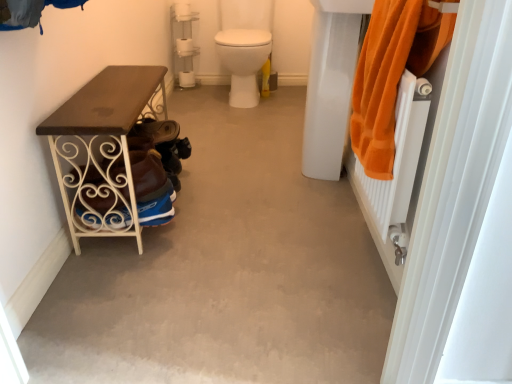
This screenshot has width=512, height=384. Find the location of `smooth concrete floor at center`. smooth concrete floor at center is located at coordinates (225, 271).

Measure the distance between orange terry cloth towel at right and camera.

orange terry cloth towel at right is 91.20 centimeters from camera.

The width and height of the screenshot is (512, 384). What do you see at coordinates (245, 63) in the screenshot?
I see `white glossy toilet at center` at bounding box center [245, 63].

Measure the distance between white glossy toilet at center and camera.

white glossy toilet at center is 8.33 feet from camera.

I want to click on brown wood table at left, so click(x=103, y=151).

Can you confirm if brown wood table at left is positioned to the right of brown suede shoe at lower left?

No, brown wood table at left is not to the right of brown suede shoe at lower left.

Is brown wood table at left surrounding brown suede shoe at lower left?

Yes, brown suede shoe at lower left is inside brown wood table at left.

Can you tell me how much brown wood table at left and brown suede shoe at lower left differ in facing direction?

0.00465 degrees.

Is brown wood table at left turned away from brown suede shoe at lower left?

Absolutely, brown wood table at left is directed away from brown suede shoe at lower left.

How much distance is there between brown suede shoe at lower left and brown wood table at left?

10.58 inches.

From the image's perspective, is brown suede shoe at lower left beneath brown wood table at left?

Actually, brown suede shoe at lower left appears above brown wood table at left in the image.

Is point (152, 120) positioned before point (129, 175)?

No, it is behind (129, 175).

Where is `furniture that is in front of the brown suede shoe at lower left`? furniture that is in front of the brown suede shoe at lower left is located at coordinates [103, 151].

Does point (245, 197) lie in front of point (100, 78)?

No, (245, 197) is further to viewer.

Considering the sizes of objects smooth concrete floor at center and brown wood table at left in the image provided, who is bigger, smooth concrete floor at center or brown wood table at left?

Bigger between the two is brown wood table at left.

Is smooth concrete floor at center spatially inside brown wood table at left, or outside of it?

smooth concrete floor at center lies outside brown wood table at left.

From their relative heights in the image, would you say smooth concrete floor at center is taller or shorter than brown wood table at left?

Considering their sizes, smooth concrete floor at center has less height than brown wood table at left.

Visually, is orange terry cloth towel at right positioned to the left or to the right of brown wood table at left?

orange terry cloth towel at right is to the right of brown wood table at left.

Does point (379, 70) lie in front of point (63, 154)?

Yes, it is.

Which of these two, orange terry cloth towel at right or brown wood table at left, is bigger?

brown wood table at left is bigger.

Is brown wood table at left inside orange terry cloth towel at right?

No, brown wood table at left is located outside of orange terry cloth towel at right.

Is brown wood table at left positioned beyond the bounds of orange terry cloth towel at right?

Yes.

Is brown wood table at left directly adjacent to orange terry cloth towel at right?

They are not placed beside each other.

Locate an element on the screen. furniture on the left of orange terry cloth towel at right is located at coordinates (103, 151).

Considering the sizes of objects white glossy toilet at center and smooth concrete floor at center in the image provided, who is shorter, white glossy toilet at center or smooth concrete floor at center?

With less height is smooth concrete floor at center.

Looking at this image, is white glossy toilet at center facing towards smooth concrete floor at center?

Yes, white glossy toilet at center is turned towards smooth concrete floor at center.

From a real-world perspective, is white glossy toilet at center positioned above or below smooth concrete floor at center?

white glossy toilet at center is situated higher than smooth concrete floor at center in the real world.

Is white glossy toilet at center not near smooth concrete floor at center?

Yes, white glossy toilet at center is far from smooth concrete floor at center.

Which of these two, brown suede shoe at lower left or white glossy sink at upper right, is wider?

white glossy sink at upper right.

Is brown suede shoe at lower left aimed at white glossy sink at upper right?

Yes, brown suede shoe at lower left is aimed at white glossy sink at upper right.

Is there a large distance between brown suede shoe at lower left and white glossy sink at upper right?

No, there isn't a large distance between brown suede shoe at lower left and white glossy sink at upper right.

Locate an element on the screen. shoe lying above the brown wood table at left (from the image's perspective) is located at coordinates (156, 130).

Where is `shoe on the right of brown wood table at left`? This screenshot has height=384, width=512. shoe on the right of brown wood table at left is located at coordinates (156, 130).

When comparing their distances from brown wood table at left, does orange terry cloth towel at right or white glossy toilet at center seem further?

white glossy toilet at center lies further to brown wood table at left than the other object.

Based on the photo, which object lies further to the anchor point brown wood table at left, orange terry cloth towel at right or smooth concrete floor at center?

orange terry cloth towel at right.

In the scene shown: From the image, which object appears to be nearer to white glossy sink at upper right, white glossy toilet at center or brown wood table at left?

brown wood table at left is closer to white glossy sink at upper right.

From the picture: Estimate the real-world distances between objects in this image. Which object is further from smooth concrete floor at center, white glossy sink at upper right or white glossy toilet at center?

white glossy toilet at center is positioned further to the anchor smooth concrete floor at center.

Considering their positions, is white glossy sink at upper right positioned closer to smooth concrete floor at center than brown wood table at left?

brown wood table at left is positioned closer to the anchor smooth concrete floor at center.

Based on their spatial positions, is white glossy sink at upper right or orange terry cloth towel at right closer to brown suede shoe at lower left?

white glossy sink at upper right.

When comparing their distances from white glossy toilet at center, does orange terry cloth towel at right or brown suede shoe at lower left seem further?

Based on the image, orange terry cloth towel at right appears to be further to white glossy toilet at center.

Looking at the image, which one is located closer to orange terry cloth towel at right, smooth concrete floor at center or brown suede shoe at lower left?

smooth concrete floor at center lies closer to orange terry cloth towel at right than the other object.

Locate an element on the screen. concrete between orange terry cloth towel at right and white glossy sink at upper right from front to back is located at coordinates (225, 271).

Find the location of a particular element. shoe between brown wood table at left and orange terry cloth towel at right from left to right is located at coordinates (156, 130).

Identify the location of shoe positioned between brown wood table at left and white glossy toilet at center from near to far. (156, 130).

Where is `sink between brown wood table at left and orange terry cloth towel at right in the horizontal direction`? Image resolution: width=512 pixels, height=384 pixels. sink between brown wood table at left and orange terry cloth towel at right in the horizontal direction is located at coordinates (330, 85).